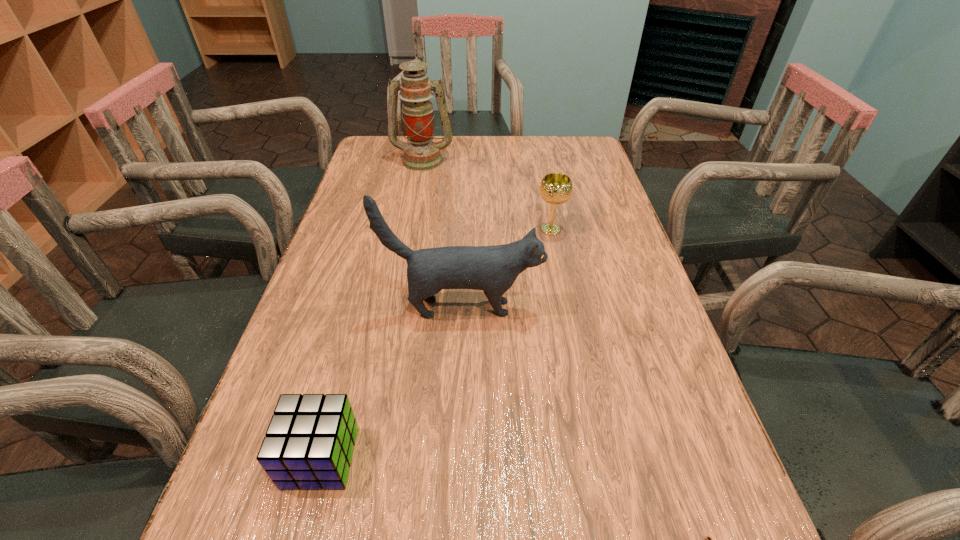
Identify the location of the farthest object. (421, 154).

The height and width of the screenshot is (540, 960). Find the location of `the third farthest object`. the third farthest object is located at coordinates (493, 269).

At what (x,y) coordinates should I click in order to perform the action: click on the fourth object from left to right. Please return your answer as a coordinate pair (x, y). Looking at the image, I should click on (555, 188).

The height and width of the screenshot is (540, 960). I want to click on chalice, so click(555, 188).

The image size is (960, 540). What are the coordinates of `the fourth farthest object` in the screenshot? It's located at (309, 444).

Find the location of a particular element. The width and height of the screenshot is (960, 540). vacant area located 0.260m on the front of the farthest object is located at coordinates (411, 221).

This screenshot has width=960, height=540. Find the location of `blank space located 0.110m at the face of the cat`. blank space located 0.110m at the face of the cat is located at coordinates (592, 308).

At what (x,y) coordinates should I click in order to perform the action: click on free spot located on the right of the third tallest object. Please return your answer as a coordinate pair (x, y). This screenshot has height=540, width=960. Looking at the image, I should click on coord(597,230).

Identify the location of free spot located 0.230m on the right of the fourth farthest object. The height and width of the screenshot is (540, 960). (497, 457).

The image size is (960, 540). What are the coordinates of `object that is at the far edge` in the screenshot? It's located at (421, 154).